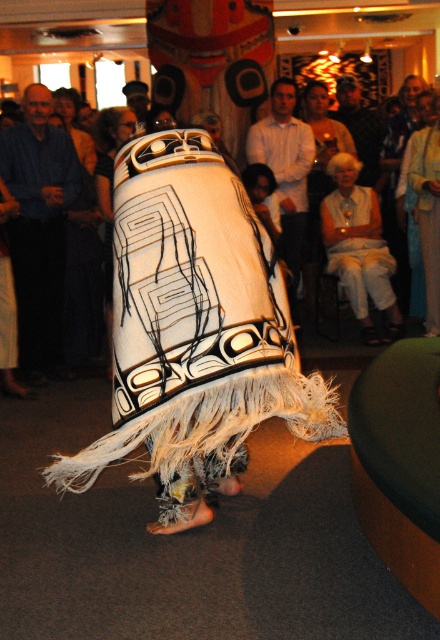
Question: Is white woven fabric at center to the right of smooth brown leather jacket at upper center from the viewer's perspective?

Choices:
 (A) no
 (B) yes

Answer: (A)

Question: Which of the following is the farthest from the observer?

Choices:
 (A) (263, 156)
 (B) (360, 150)

Answer: (B)

Question: Is blue cotton shirt at left behind smooth brown leather jacket at upper center?

Choices:
 (A) yes
 (B) no

Answer: (B)

Question: Estimate the real-world distances between objects in this image. Which object is farther from the blue cotton shirt at left?

Choices:
 (A) smooth brown leather jacket at upper center
 (B) white woven fabric at center

Answer: (A)

Question: Can you confirm if white woven fabric at center is smaller than smooth brown leather jacket at upper center?

Choices:
 (A) yes
 (B) no

Answer: (B)

Question: Which is farther from the white woven fabric at center?

Choices:
 (A) smooth brown leather jacket at upper center
 (B) blue cotton shirt at left

Answer: (B)